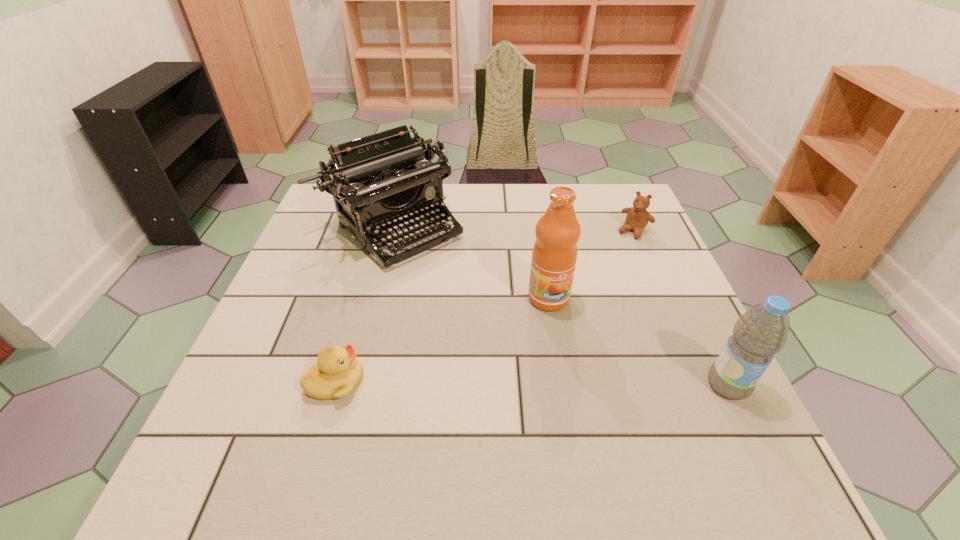
Locate an element on the screen. The height and width of the screenshot is (540, 960). free space on the desktop that is between the duckling and the water bottle and is positioned on the label side of the fruit juice is located at coordinates (589, 383).

Image resolution: width=960 pixels, height=540 pixels. What are the coordinates of `vacant spot on the desktop that is between the shortest object and the water bottle and is positioned on the keyboard of the typewriter` in the screenshot? It's located at (562, 383).

At what (x,y) coordinates should I click in order to perform the action: click on vacant space on the desktop that is between the shortest object and the water bottle and is positioned on the face of the fourth tallest object. Please return your answer as a coordinate pair (x, y). This screenshot has width=960, height=540. Looking at the image, I should click on (521, 383).